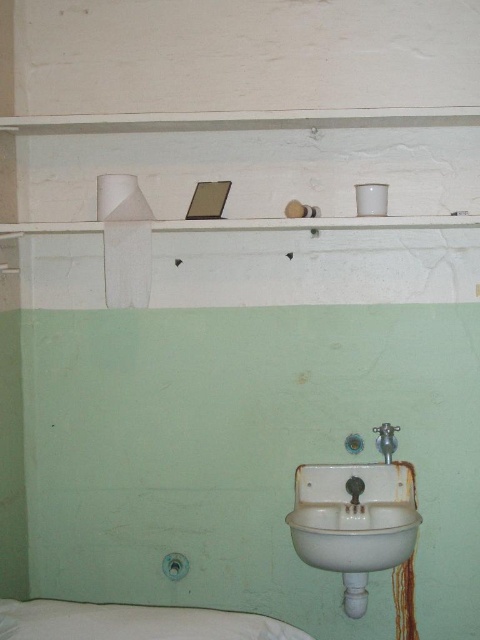
Question: Does white fabric bed at lower left appear under silver metallic faucet at lower center?

Choices:
 (A) yes
 (B) no

Answer: (A)

Question: Which object is the closest to the white porcelain sink at lower center?

Choices:
 (A) white ceramic faucet at lower center
 (B) silver metallic faucet at lower center
 (C) white fabric bed at lower left

Answer: (A)

Question: Does white porcelain sink at lower center appear on the right side of silver metallic faucet at lower center?

Choices:
 (A) no
 (B) yes

Answer: (A)

Question: Does white porcelain sink at lower center have a greater width compared to white ceramic faucet at lower center?

Choices:
 (A) yes
 (B) no

Answer: (A)

Question: Based on their relative distances, which object is farther from the white ceramic faucet at lower center?

Choices:
 (A) white porcelain sink at lower center
 (B) white fabric bed at lower left

Answer: (B)

Question: Which object is the farthest from the white porcelain sink at lower center?

Choices:
 (A) white fabric bed at lower left
 (B) silver metallic faucet at lower center
 (C) white ceramic faucet at lower center

Answer: (A)